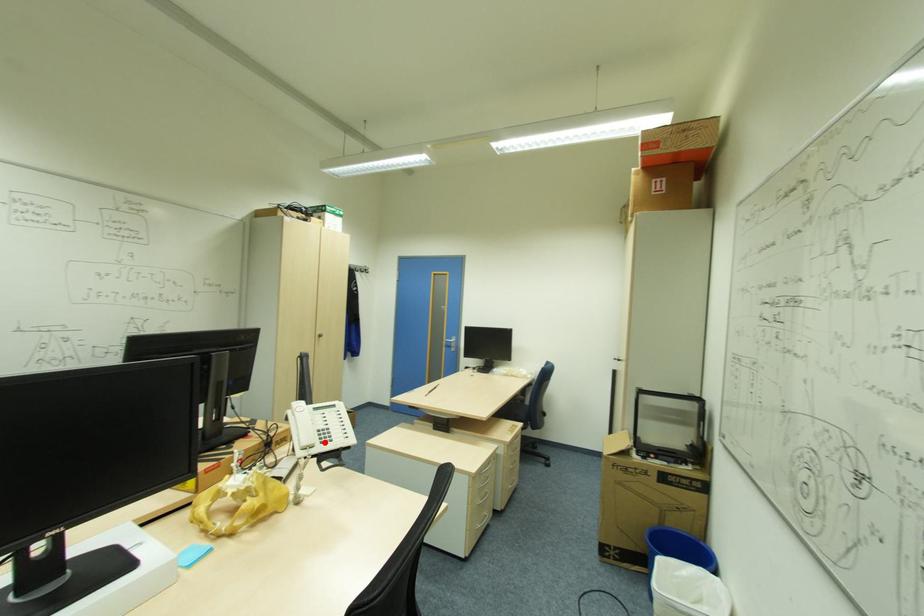
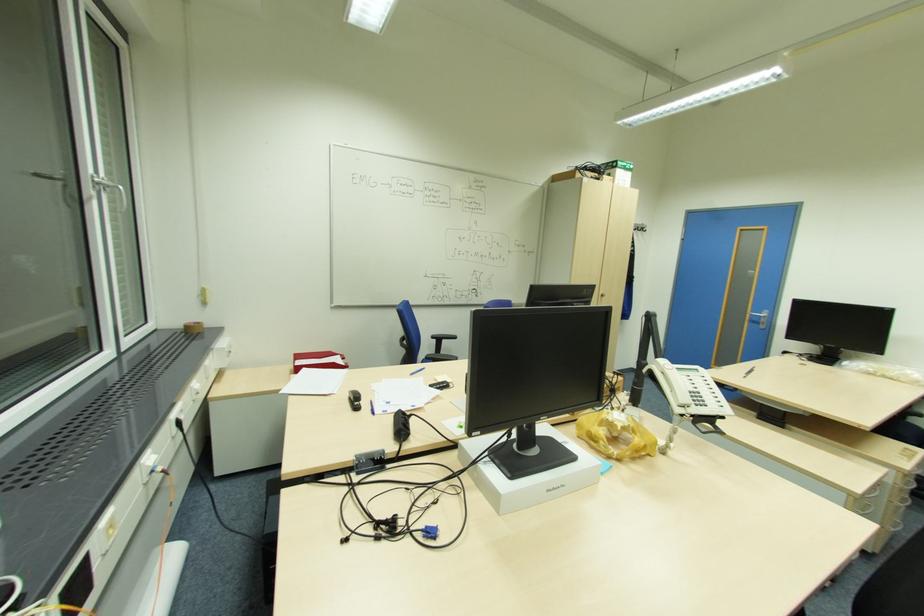
Question: I am providing you with two images of the same scene from different viewpoints. A red point is marked on the first image. Is the red point's position out of view in image 2?

Choices:
 (A) Yes
 (B) No

Answer: (B)